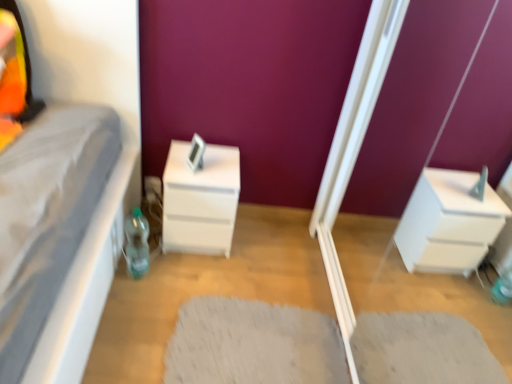
You are a GUI agent. You are given a task and a screenshot of the screen. Output one action in this format:
    pyautogui.click(x=<x>, y=<y>)
    Task: Click on the free location above white matte chest of drawers at center (from a real-world perspective)
    This screenshot has width=512, height=384.
    Given the screenshot: What is the action you would take?
    pyautogui.click(x=198, y=169)